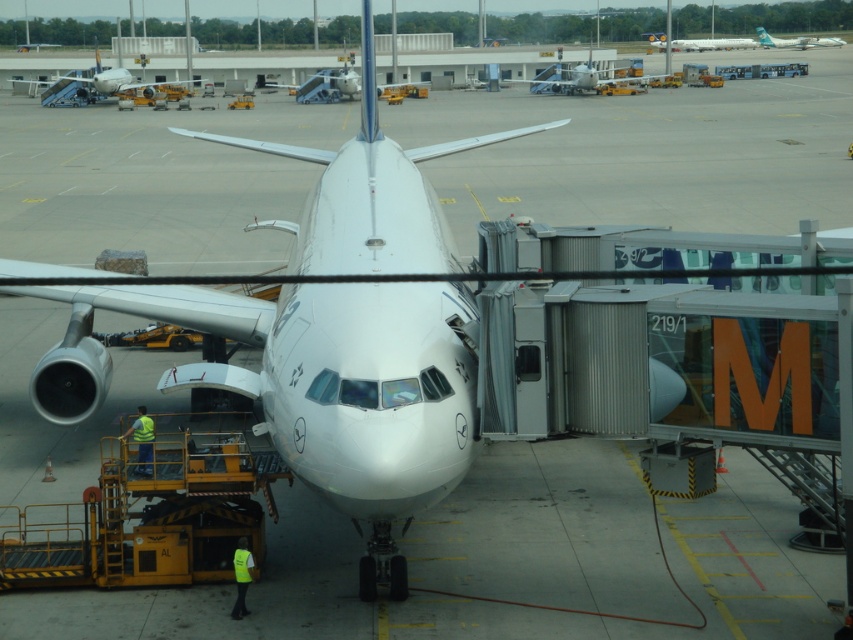
Can you confirm if silver metallic airplane at center is shorter than neon yellow safety vest at lower left?

No.

Is point (323, 80) in front of point (238, 589)?

No, (323, 80) is further to viewer.

Find the location of a particular element. This screenshot has width=853, height=640. silver metallic airplane at center is located at coordinates (326, 84).

Image resolution: width=853 pixels, height=640 pixels. I want to click on silver metallic airplane at center, so click(x=326, y=84).

Can you confirm if silver metallic airplane at center is positioned above metallic silver airplane at upper center?

No.

Based on the photo, does silver metallic airplane at center have a greater width compared to metallic silver airplane at upper center?

No.

Is point (318, 97) positioned after point (666, 45)?

No, (318, 97) is in front of (666, 45).

Where is `silver metallic airplane at center`? silver metallic airplane at center is located at coordinates (326, 84).

This screenshot has height=640, width=853. Describe the element at coordinates (96, 86) in the screenshot. I see `white glossy airplane at upper left` at that location.

Between white glossy airplane at upper left and silver metallic airplane at upper right, which one has less height?

silver metallic airplane at upper right is shorter.

Locate an element on the screen. This screenshot has width=853, height=640. white glossy airplane at upper left is located at coordinates (96, 86).